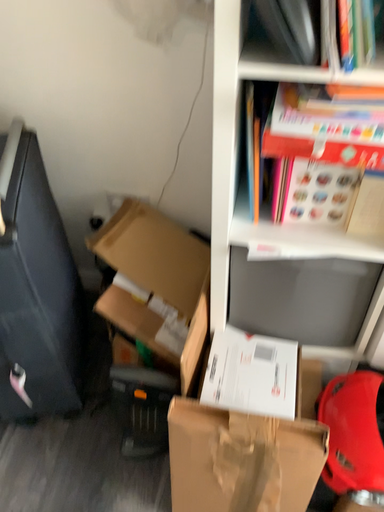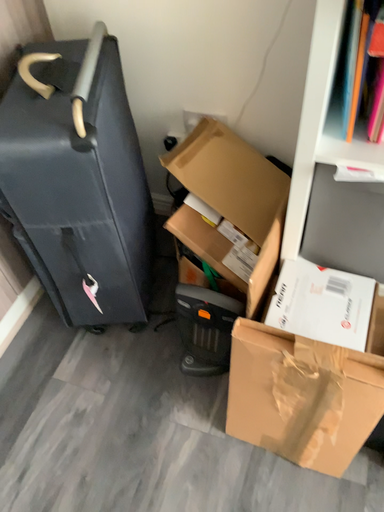
Question: How did the camera likely rotate when shooting the video?

Choices:
 (A) rotated right
 (B) rotated left

Answer: (B)